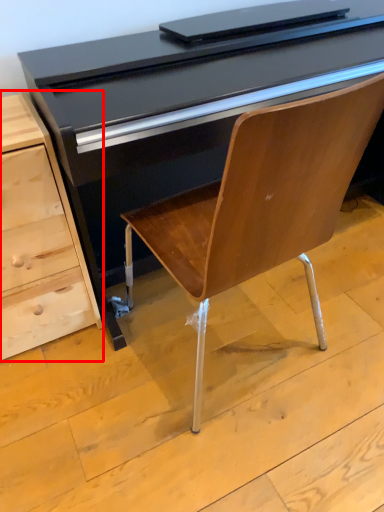
Question: In this image, where is chest of drawers (annotated by the red box) located relative to desk?

Choices:
 (A) left
 (B) right

Answer: (A)